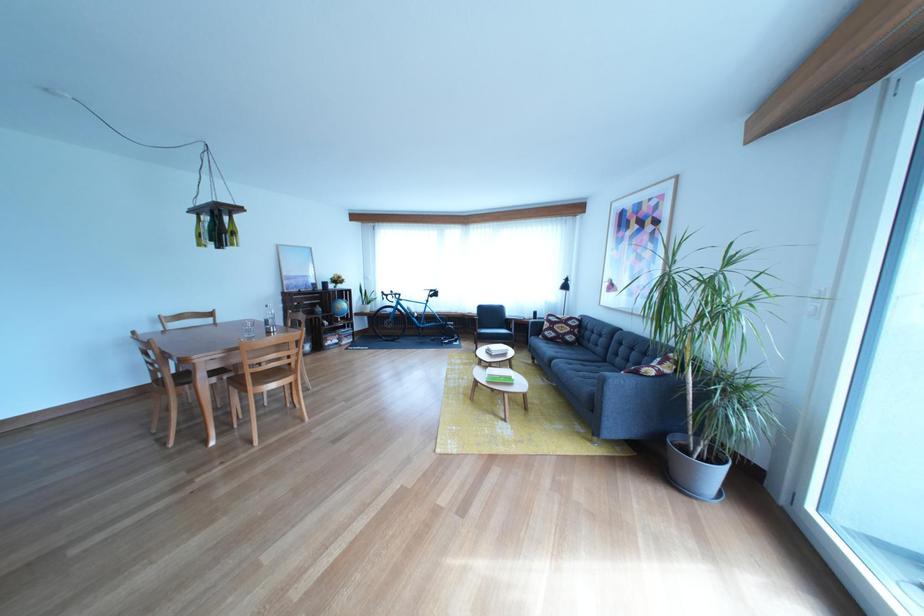
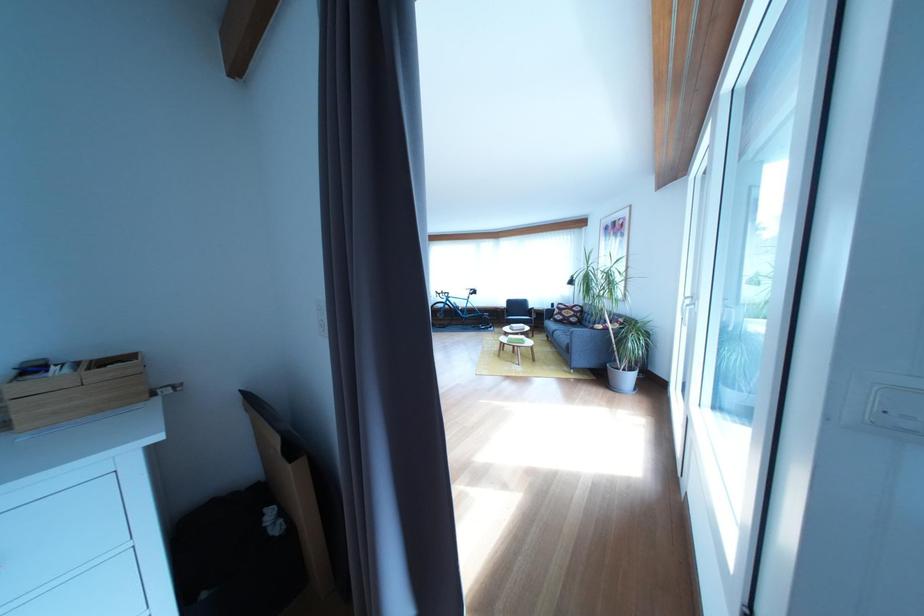
Locate, in the second image, the point that corresponds to pixel 566 341 in the first image.

(575, 323)